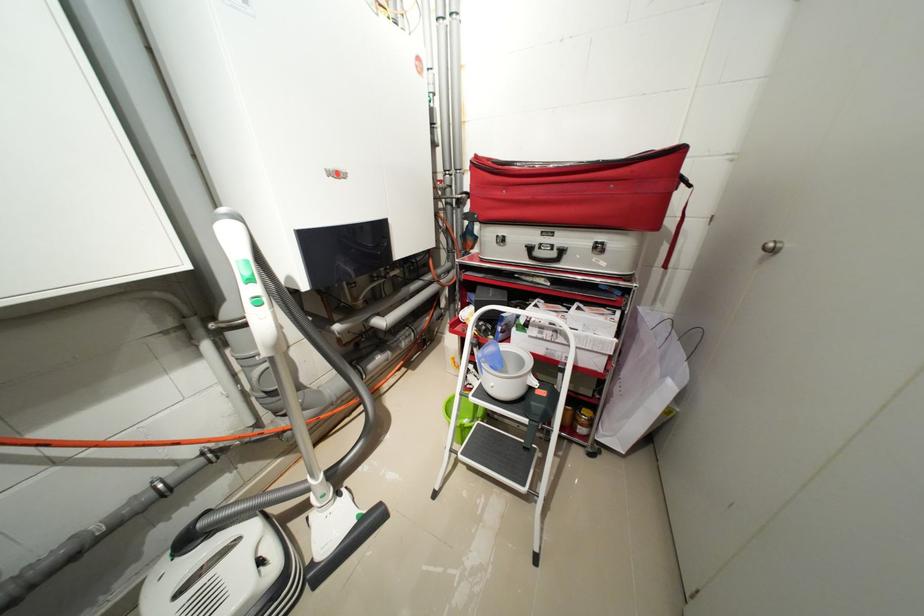
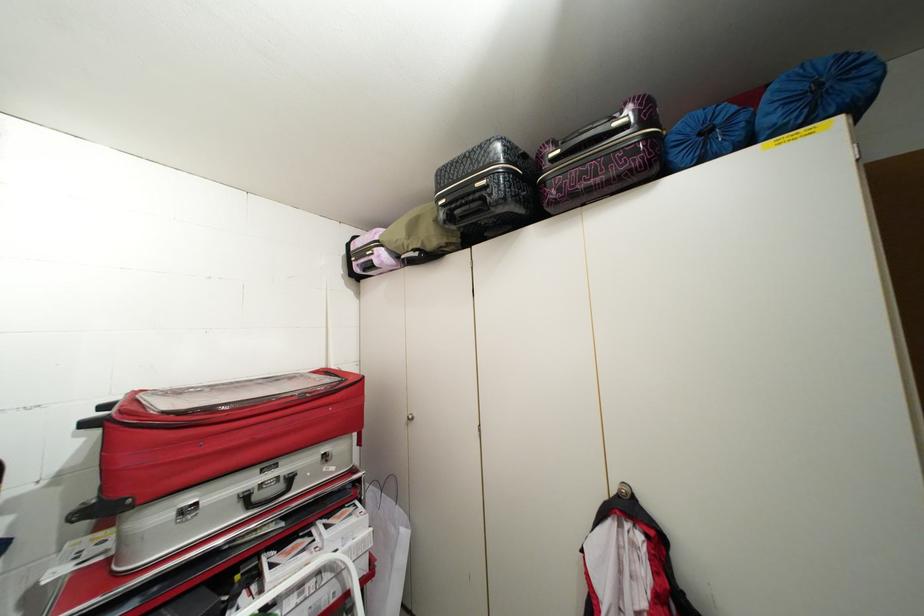
Question: The camera is either moving clockwise (left) or counter-clockwise (right) around the object. The first image is from the beginning of the video and the second image is from the end. Is the camera moving left or right when shooting the video?

Choices:
 (A) Left
 (B) Right

Answer: (A)